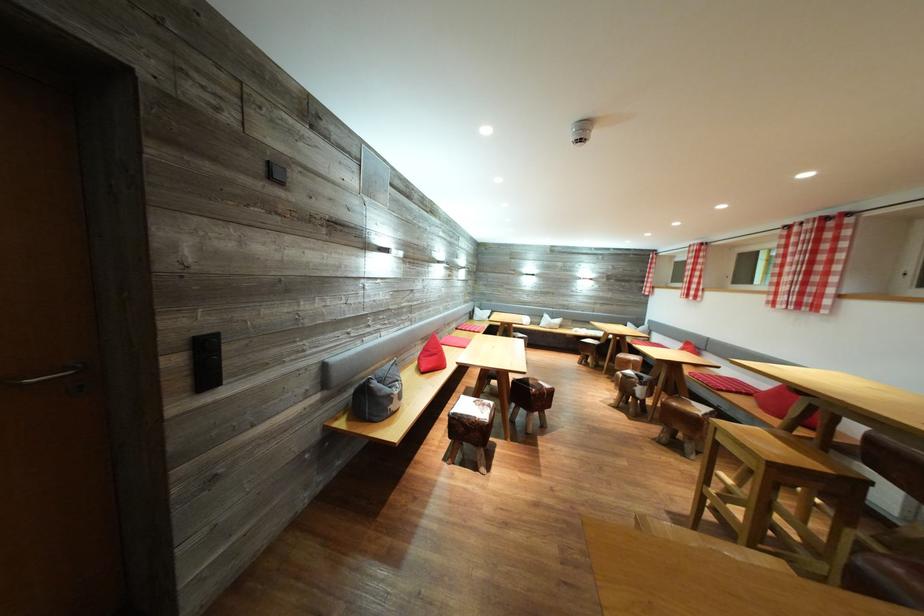
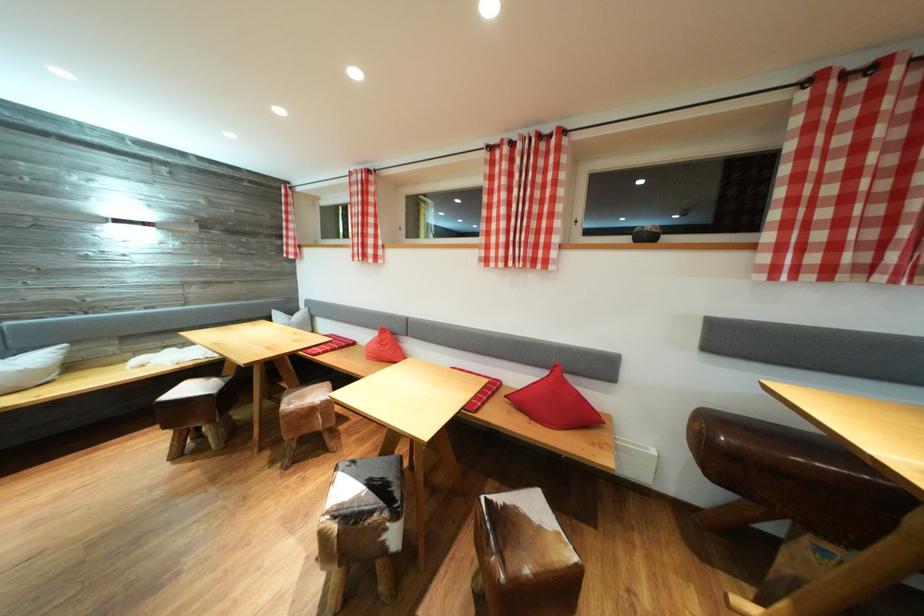
Locate, in the second image, the point that corresponds to [648,390] in the first image.

(403, 522)